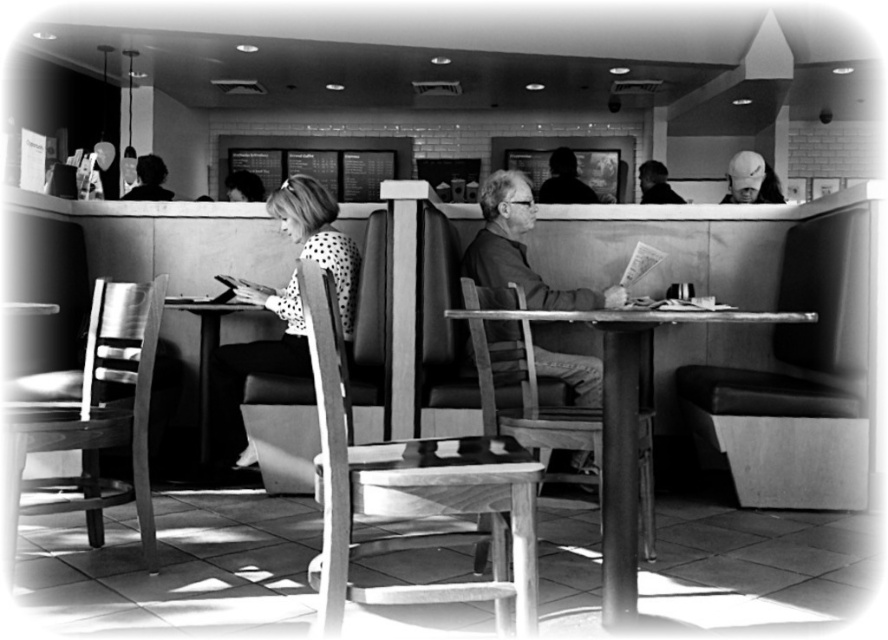
Who is more distant from viewer, (542, 202) or (649, 170)?

Positioned behind is point (649, 170).

Is smooth leather jacket at upper center smaller than dark brown leather jacket at upper right?

Yes.

Does point (559, 166) lie in front of point (680, 202)?

That is False.

Where is `smooth leather jacket at upper center`? This screenshot has height=640, width=888. smooth leather jacket at upper center is located at coordinates (564, 180).

Between white matte baseball cap at upper right and smooth leather jacket at upper center, which one has less height?

With less height is white matte baseball cap at upper right.

Who is lower down, white matte baseball cap at upper right or smooth leather jacket at upper center?

white matte baseball cap at upper right is below.

The image size is (888, 640). What are the coordinates of `white matte baseball cap at upper right` in the screenshot? It's located at (751, 180).

Is wooden table at lower left smaller than smooth leather jacket at upper center?

No.

Between point (205, 314) and point (561, 184), which one is positioned behind?

The point (561, 184) is behind.

Find the location of `wooden table at lower left`. wooden table at lower left is located at coordinates (205, 356).